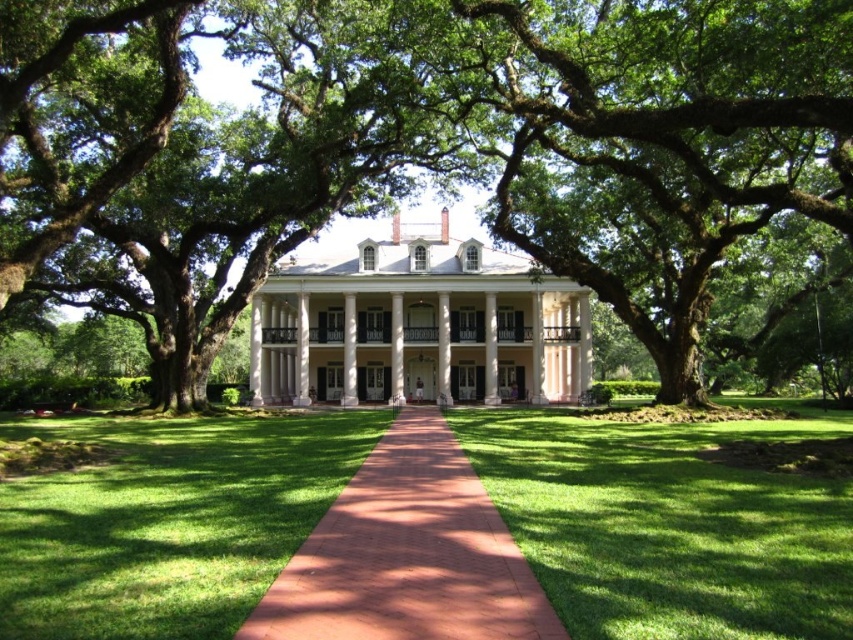
You are standing at the entrance of the mansion and see the green leafy tree at center and the green grass at center. Which object is positioned to the left?

The green leafy tree at center is to the left of green grass at center.

You are a gardener planning to mow the green grass at center. Considering the size of the green leafy tree at center, will it be a challenge to maneuver the lawnmower around it?

The green leafy tree at center is bigger than green grass at center, so it will be a challenge to maneuver the lawnmower around it due to its larger size.